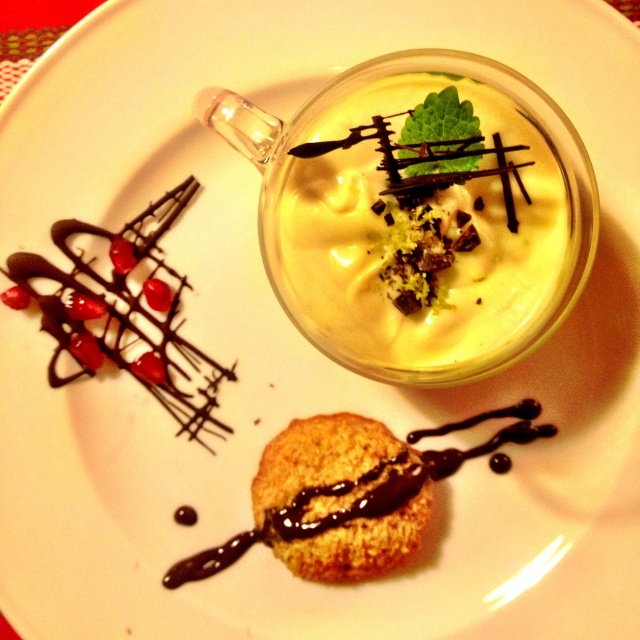
Question: Which of the following is the farthest from the observer?

Choices:
 (A) golden crumbly cookie at center
 (B) yellow creamy pudding at center

Answer: (A)

Question: Can you confirm if yellow creamy pudding at center is bigger than golden crumbly cookie at center?

Choices:
 (A) no
 (B) yes

Answer: (B)

Question: Is yellow creamy pudding at center thinner than golden crumbly cookie at center?

Choices:
 (A) yes
 (B) no

Answer: (B)

Question: Does yellow creamy pudding at center appear on the right side of golden crumbly cookie at center?

Choices:
 (A) no
 (B) yes

Answer: (B)